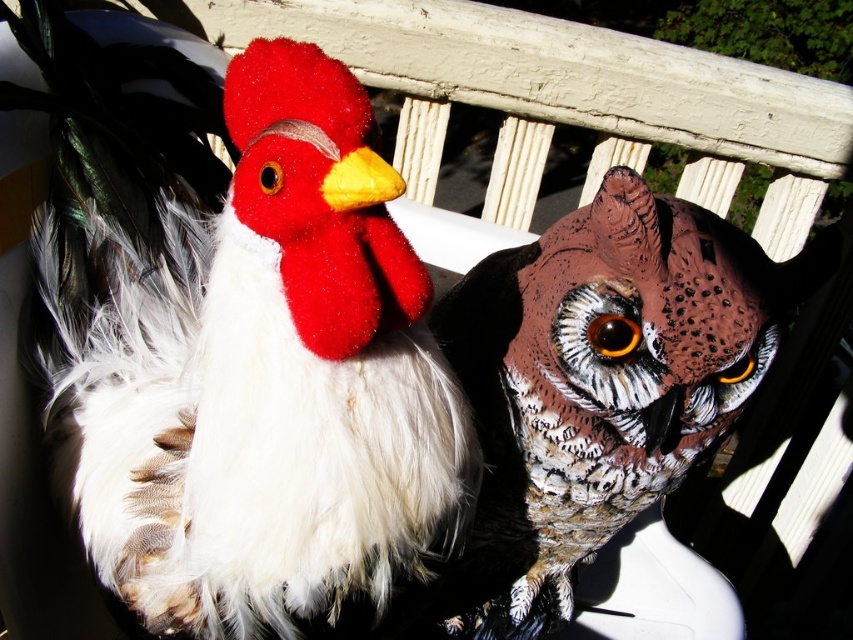
Question: Does white soft plush at center have a larger size compared to speckled brown owl at center?

Choices:
 (A) no
 (B) yes

Answer: (B)

Question: Is white soft plush at center in front of speckled brown owl at center?

Choices:
 (A) yes
 (B) no

Answer: (A)

Question: Can you confirm if white soft plush at center is smaller than speckled brown owl at center?

Choices:
 (A) yes
 (B) no

Answer: (B)

Question: Which point is closer to the camera?

Choices:
 (A) (173, 404)
 (B) (628, 410)

Answer: (A)